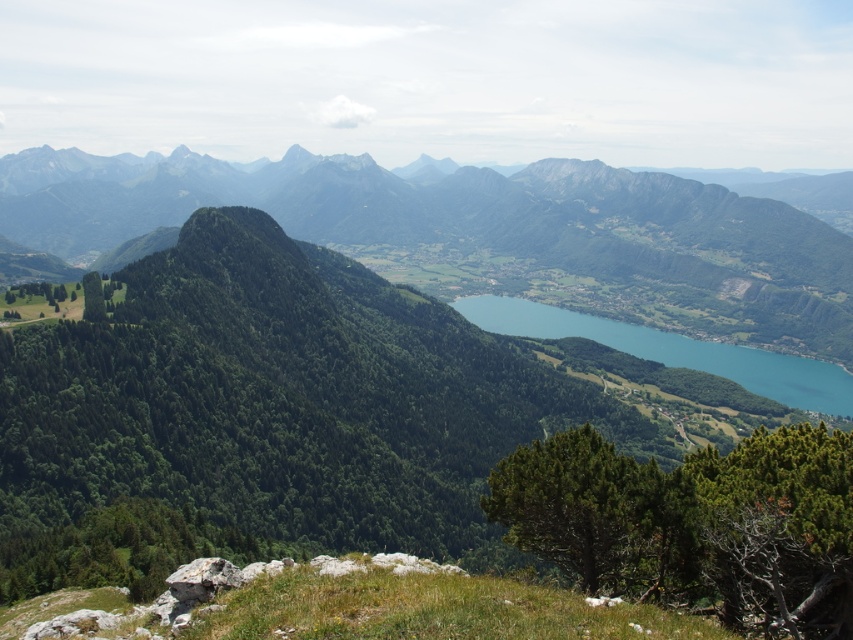
Which is behind, point (631, 193) or point (570, 320)?

The point (631, 193) is behind.

Between green forested mountain at center and blue glassy lake at center, which one appears on the left side from the viewer's perspective?

green forested mountain at center is more to the left.

Find the location of a particular element. The image size is (853, 640). green forested mountain at center is located at coordinates (483, 232).

Identify the location of green forested mountain at center. (483, 232).